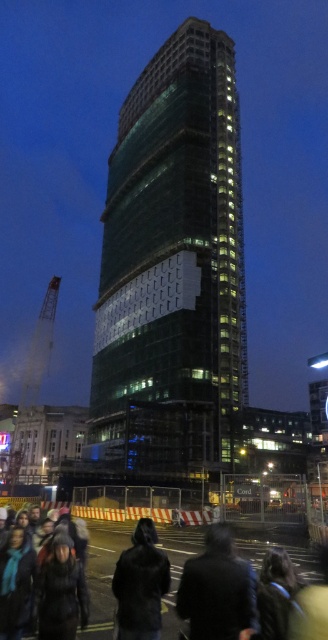
Question: Does green glass tower at center lie behind black wool coat at lower center?

Choices:
 (A) no
 (B) yes

Answer: (B)

Question: Which is nearer to the black wool coat at lower center?

Choices:
 (A) dark brown leather jacket at lower center
 (B) dark fur coat at lower center
 (C) metallic yellow crane at left
 (D) green glass tower at center

Answer: (B)

Question: Does dark brown leather jacket at lower center come behind black wool coat at lower center?

Choices:
 (A) yes
 (B) no

Answer: (A)

Question: Does green glass tower at center have a lesser width compared to metallic yellow crane at left?

Choices:
 (A) no
 (B) yes

Answer: (B)

Question: Which of the following is the closest to the observer?

Choices:
 (A) (221, 611)
 (B) (106, 531)
 (C) (173, 108)
 (D) (157, 636)

Answer: (A)

Question: Estimate the real-world distances between objects in this image. Which object is farther from the dark brown leather jacket at lower center?

Choices:
 (A) metallic yellow crane at left
 (B) green glass tower at center
 (C) dark fur coat at lower center
 (D) black wool coat at lower center

Answer: (A)